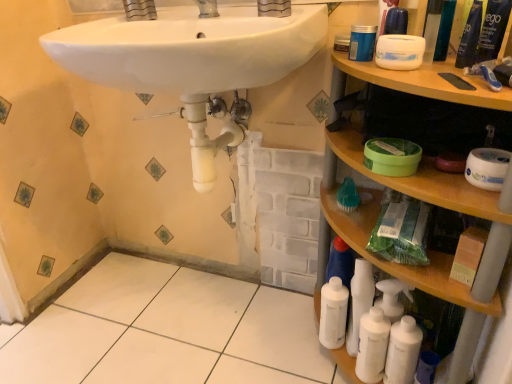
This screenshot has width=512, height=384. What are the coordinates of `vacant area that is in front of white matte container at upper right, the 2th toilet paper ordered from the bottom` in the screenshot? It's located at (429, 81).